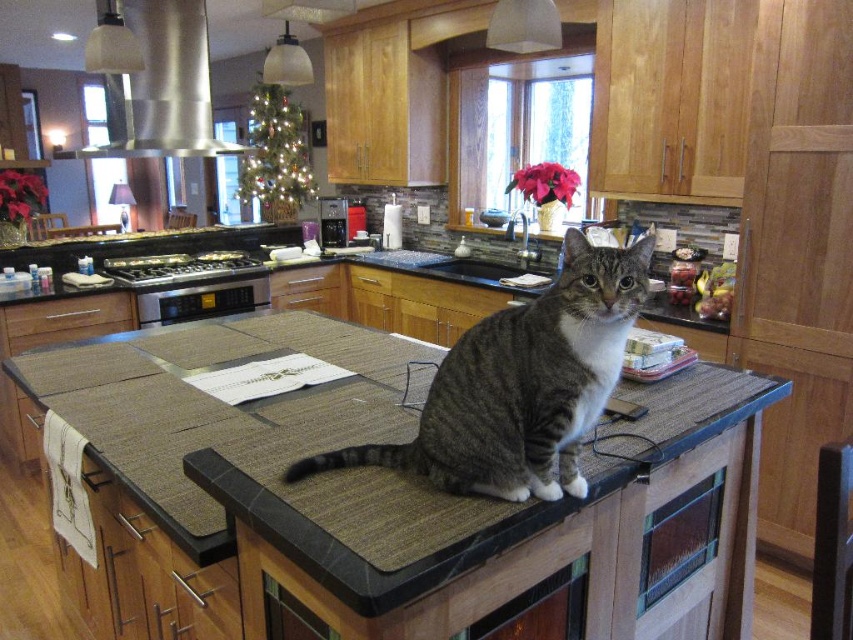
You are a photographer planning to take a portrait of the gray striped cat at center and the satin silver exhaust hood at upper left. If you want to ensure both subjects are in focus, which one should you prioritize focusing on first, considering their sizes?

The gray striped cat at center has a lesser width compared to the satin silver exhaust hood at upper left. Therefore, you should prioritize focusing on the satin silver exhaust hood at upper left first since it is larger and might require more precise focus to capture details.

You are standing 5 feet away from the gray striped cat at center. If you want to pet the cat, will you be able to reach it without moving closer?

The gray striped cat at center is 3.91 feet away from the camera. Since you are 5 feet away from the cat, you are 8.91 feet away from the camera. To reach the cat, you need to move closer to reduce the distance between yourself and the cat.

You are a chef preparing to clean the satin silver exhaust hood at upper left. You need to reach it without disturbing the gray striped cat at center. Is the cat currently in the way of the hood?

The gray striped cat at center is positioned under the satin silver exhaust hood at upper left, meaning the cat is directly below the hood. To reach the hood without disturbing the cat, you would need to move the cat first or work around it carefully since it is blocking access from below.